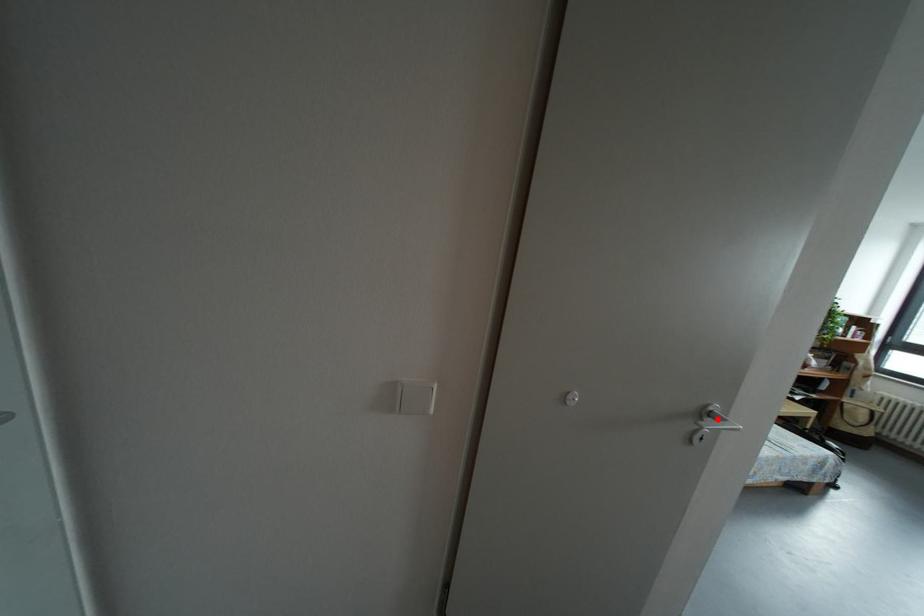
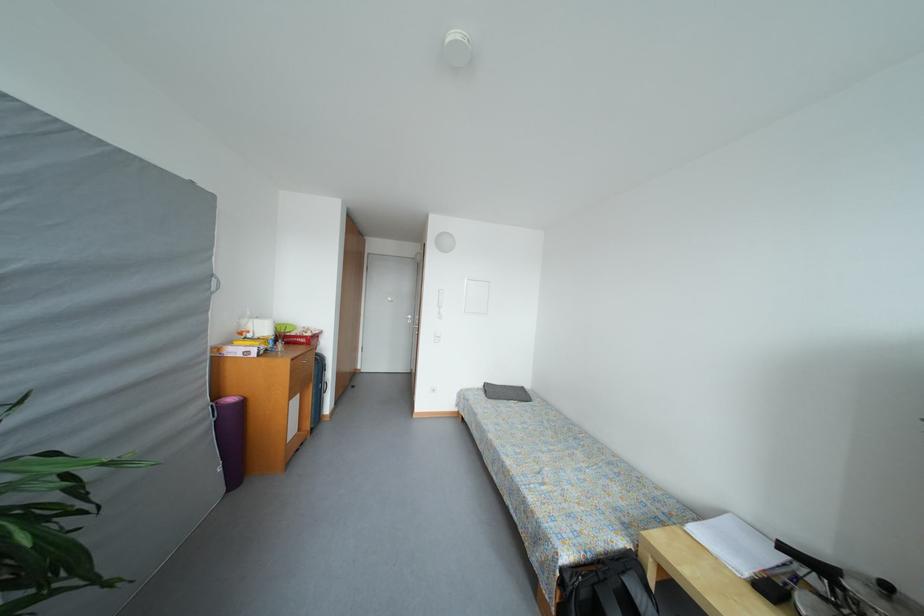
Question: I am providing you with two images of the same scene from different viewpoints. A red point is marked on the first image. Can you still see the location of the red point in image 2?

Choices:
 (A) Yes
 (B) No

Answer: (B)